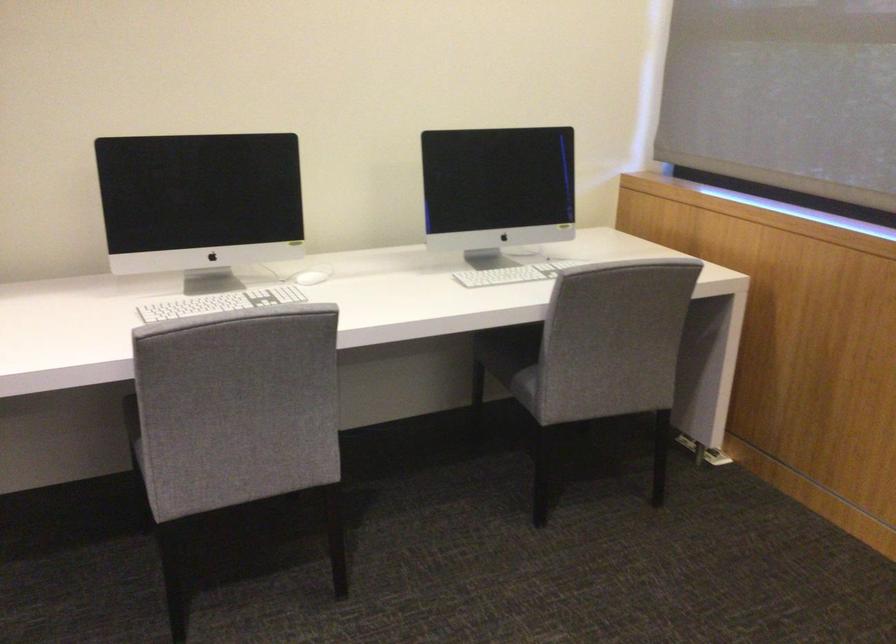
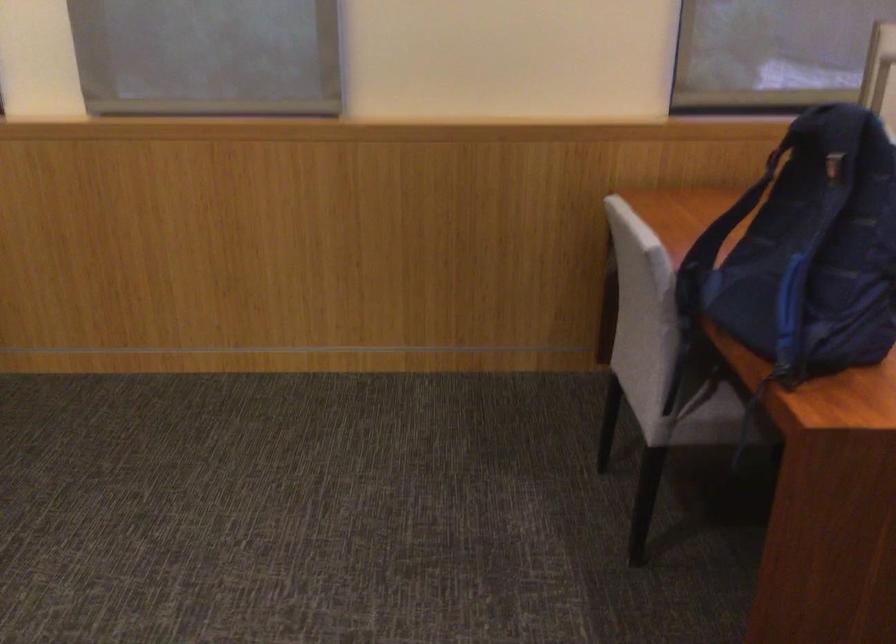
Question: The camera is either moving clockwise (left) or counter-clockwise (right) around the object. The first image is from the beginning of the video and the second image is from the end. Is the camera moving left or right when shooting the video?

Choices:
 (A) Left
 (B) Right

Answer: (A)